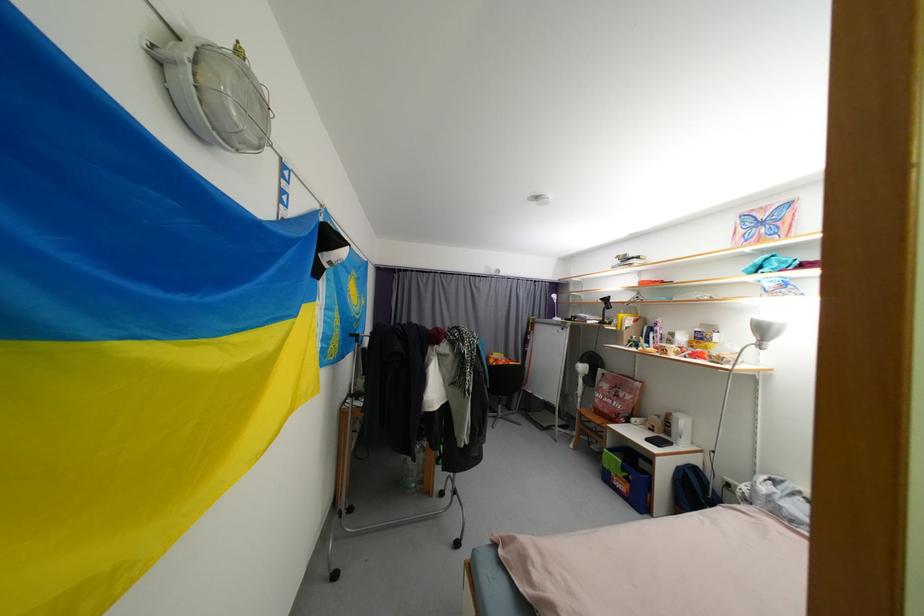
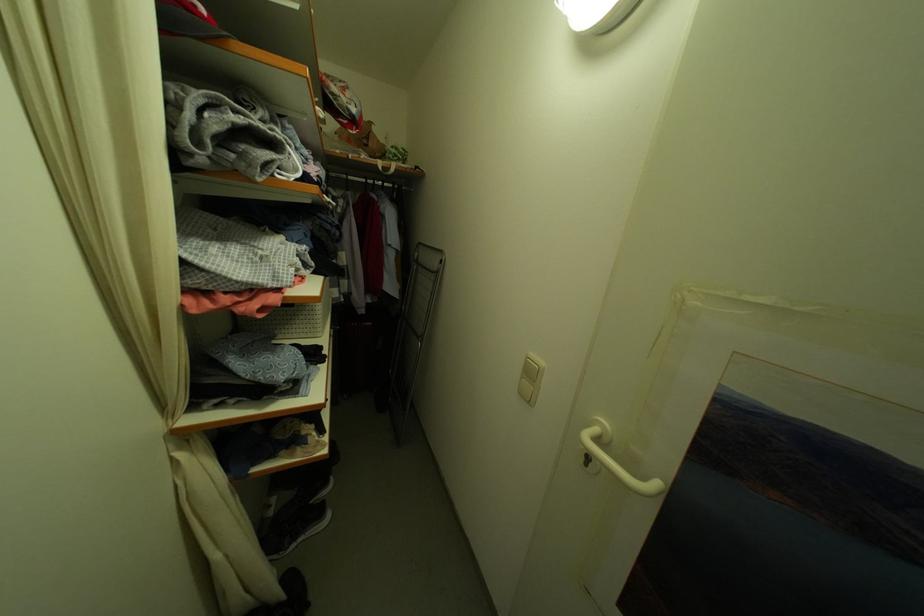
First-person continuous shooting, in which direction is the camera rotating?

The rotation direction of the camera is right-down.